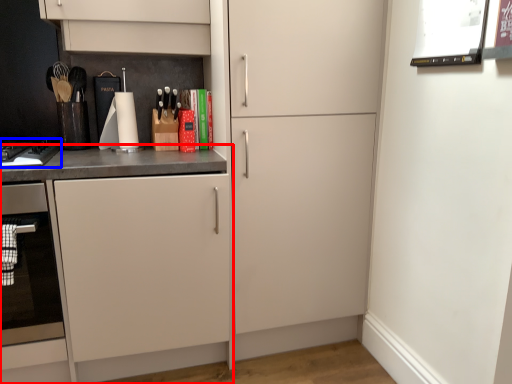
Question: Which of the following is the farthest to the observer, cabinetry (highlighted by a red box) or home appliance (highlighted by a blue box)?

Choices:
 (A) cabinetry
 (B) home appliance

Answer: (B)